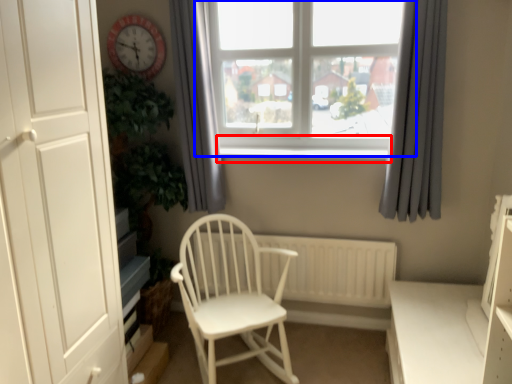
Question: Among these objects, which one is nearest to the camera, window sill (highlighted by a red box) or window (highlighted by a blue box)?

Choices:
 (A) window sill
 (B) window

Answer: (B)